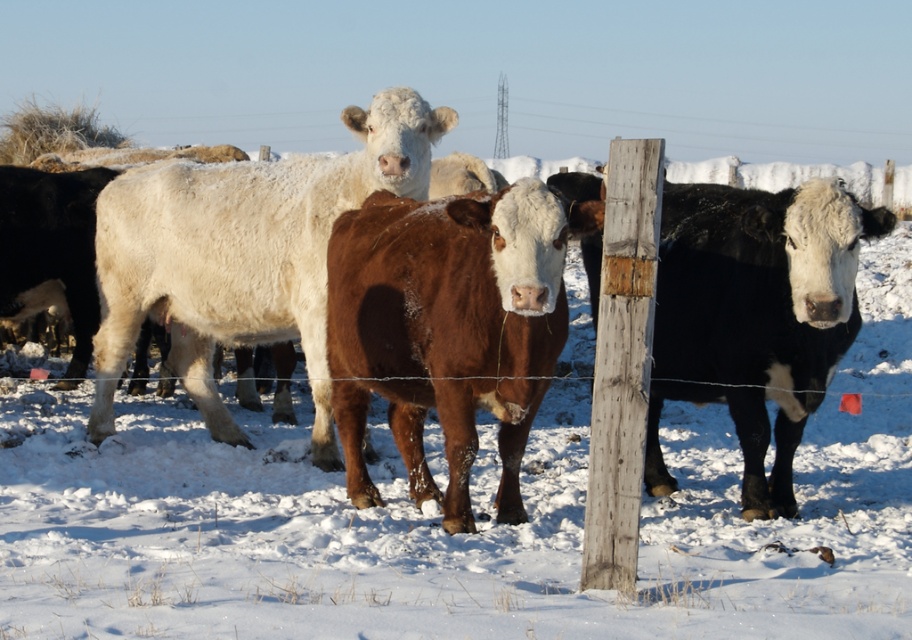
Question: From the image, what is the correct spatial relationship of white woolly bull at center in relation to black smooth cow at right?

Choices:
 (A) left
 (B) right

Answer: (A)

Question: Which object is the closest to the white woolly bull at center?

Choices:
 (A) black smooth cow at right
 (B) brown matte cow at center

Answer: (B)

Question: Is brown matte cow at center further to the viewer compared to black smooth cow at right?

Choices:
 (A) yes
 (B) no

Answer: (B)

Question: Does brown matte cow at center appear over black smooth cow at right?

Choices:
 (A) yes
 (B) no

Answer: (B)

Question: Which of the following is the farthest from the observer?

Choices:
 (A) (548, 275)
 (B) (240, 280)

Answer: (B)

Question: Which object appears farthest from the camera in this image?

Choices:
 (A) black smooth cow at right
 (B) white woolly bull at center

Answer: (B)